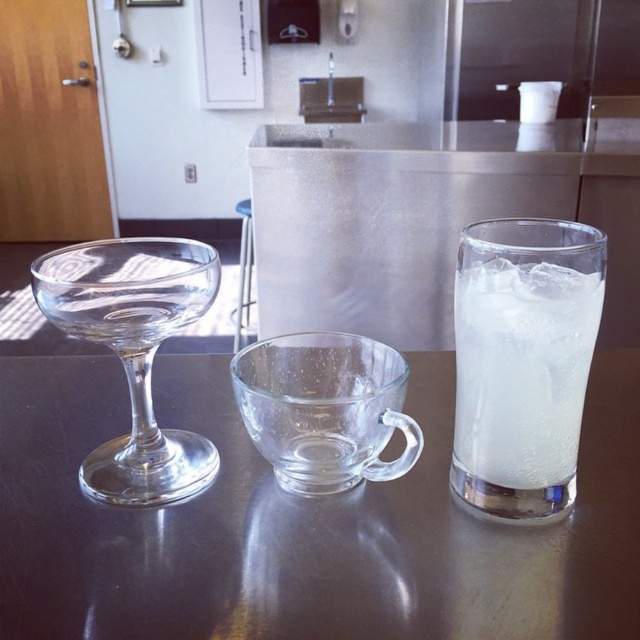
You are holding a small toy drone that is 8 inches wide. You want to fly it from your current position to the point marked at coordinate point (x=509, y=292). Can the drone safely navigate to that point without hitting any obstacles?

The point (x=509, y=292) is 10.37 inches from the camera, so yes, the drone can safely navigate to that point since the distance is greater than the drone width of 8 inches.

You are a bartender preparing drinks and need to place the transparent glass wine glass at left on the transparent glass table at center. Can you do this without moving any other items?

The transparent glass table at center is closer to the viewer than the transparent glass wine glass at left, so yes, you can place the transparent glass wine glass at left on the transparent glass table at center without moving other items since the table is in front of the wine glass.